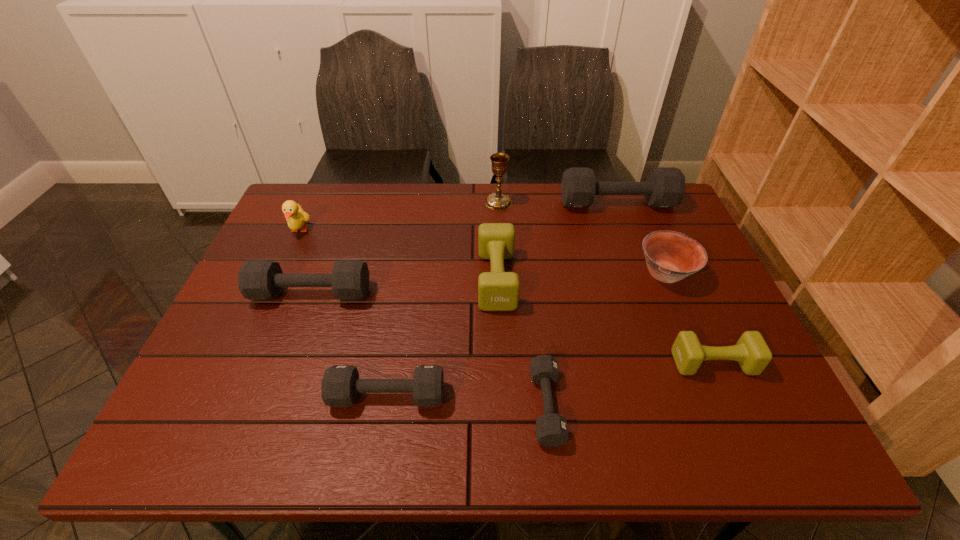
You are a GUI agent. You are given a task and a screenshot of the screen. Output one action in this format:
    pyautogui.click(x=<x>, y=<y>)
    Task: Click on the vacant position located 0.260m on the right of the third biggest gray dumbbell
    
    Given the screenshot: What is the action you would take?
    pyautogui.click(x=564, y=396)

Image resolution: width=960 pixels, height=540 pixels. Identify the location of free spot located on the back of the nearer olive dumbbell. (678, 282).

Find the location of a particular element. vacant area situated on the right of the second gray dumbbell from right to left is located at coordinates (735, 406).

Identify the location of chalice situated at the far edge. This screenshot has height=540, width=960. (498, 201).

Where is `dumbbell that is at the far edge`? Image resolution: width=960 pixels, height=540 pixels. dumbbell that is at the far edge is located at coordinates (665, 186).

At what (x,y) coordinates should I click in order to perform the action: click on duckling that is at the far edge. Please return your answer as a coordinate pair (x, y). This screenshot has width=960, height=540. Looking at the image, I should click on (295, 216).

Locate an element on the screen. This screenshot has height=540, width=960. object that is at the near edge is located at coordinates (551, 428).

The width and height of the screenshot is (960, 540). I want to click on duckling located at the left edge, so click(295, 216).

Identify the location of dumbbell present at the left edge. (257, 279).

You are a GUI agent. You are given a task and a screenshot of the screen. Output one action in this format:
    pyautogui.click(x=<x>, y=<y>)
    Task: Click on the bowl at the right edge
    
    Given the screenshot: What is the action you would take?
    pyautogui.click(x=670, y=256)